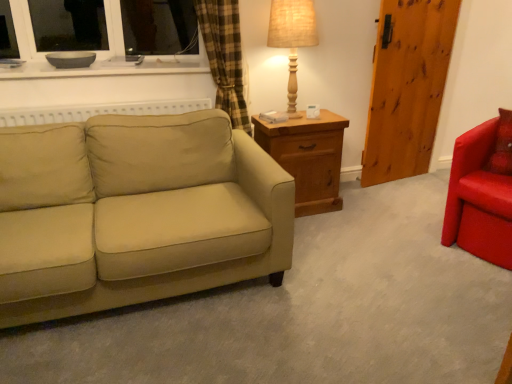
Question: From the image's perspective, is wooden nightstand at center over white glossy bowl at upper left?

Choices:
 (A) yes
 (B) no

Answer: (B)

Question: Is the depth of wooden nightstand at center less than that of white glossy bowl at upper left?

Choices:
 (A) yes
 (B) no

Answer: (B)

Question: Is wooden nightstand at center wider than white glossy bowl at upper left?

Choices:
 (A) no
 (B) yes

Answer: (A)

Question: Is wooden nightstand at center next to white glossy bowl at upper left?

Choices:
 (A) no
 (B) yes

Answer: (A)

Question: From a real-world perspective, is wooden nightstand at center under white glossy bowl at upper left?

Choices:
 (A) yes
 (B) no

Answer: (A)

Question: Based on their sizes in the image, would you say shiny red armchair at right is bigger or smaller than wooden barn door at right?

Choices:
 (A) big
 (B) small

Answer: (A)

Question: From a real-world perspective, is shiny red armchair at right physically located above or below wooden barn door at right?

Choices:
 (A) below
 (B) above

Answer: (A)

Question: From the image's perspective, relative to wooden barn door at right, is shiny red armchair at right above or below?

Choices:
 (A) above
 (B) below

Answer: (B)

Question: Is shiny red armchair at right taller or shorter than wooden barn door at right?

Choices:
 (A) short
 (B) tall

Answer: (A)

Question: In terms of width, does wooden nightstand at center look wider or thinner when compared to shiny red armchair at right?

Choices:
 (A) thin
 (B) wide

Answer: (A)

Question: Would you say wooden nightstand at center is inside or outside shiny red armchair at right?

Choices:
 (A) inside
 (B) outside

Answer: (B)

Question: Visually, is wooden nightstand at center positioned to the left or to the right of shiny red armchair at right?

Choices:
 (A) right
 (B) left

Answer: (B)

Question: Considering their positions, is wooden nightstand at center located in front of or behind shiny red armchair at right?

Choices:
 (A) behind
 (B) front

Answer: (A)

Question: From their relative heights in the image, would you say burlap fabric table lamp at upper right is taller or shorter than beige fabric couch at left?

Choices:
 (A) tall
 (B) short

Answer: (B)

Question: Is burlap fabric table lamp at upper right in front of or behind beige fabric couch at left in the image?

Choices:
 (A) behind
 (B) front

Answer: (A)